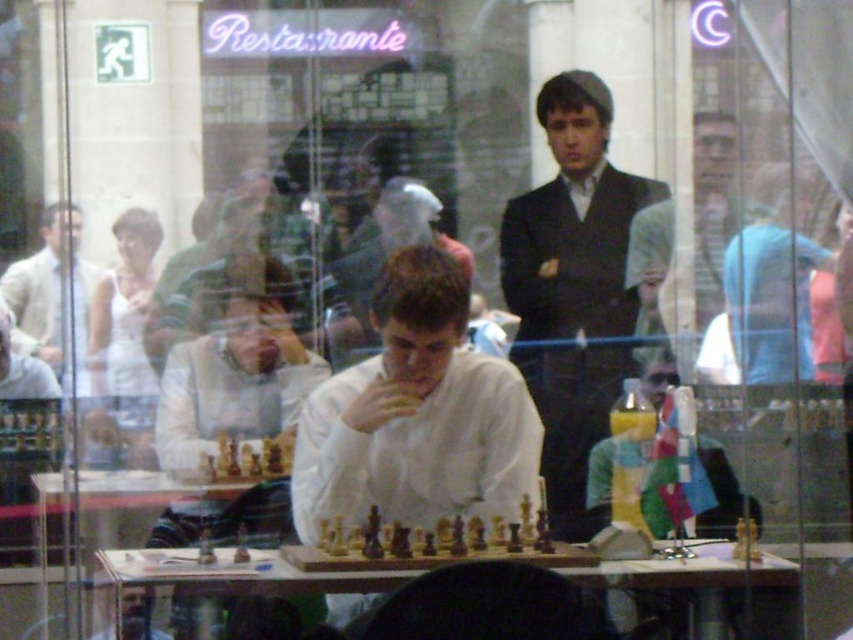
You are standing in the public space shown in the image. Where exactly is the light brown suit at center located in terms of coordinates?

The light brown suit at center is located at coordinates point (685, 243).

You are a photographer standing at the entrance of the restaurant. You want to take a photo of the white matte shirt at center and the light brown suit at center so that both are clearly visible. Considering their heights, which one should you position closer to the camera to ensure both are fully visible in the frame?

The white matte shirt at center is taller than the light brown suit at center. To ensure both are fully visible in the frame, position the light brown suit at center closer to the camera so that the taller white matte shirt at center and the shorter light brown suit at center can be captured without any part being cut off.